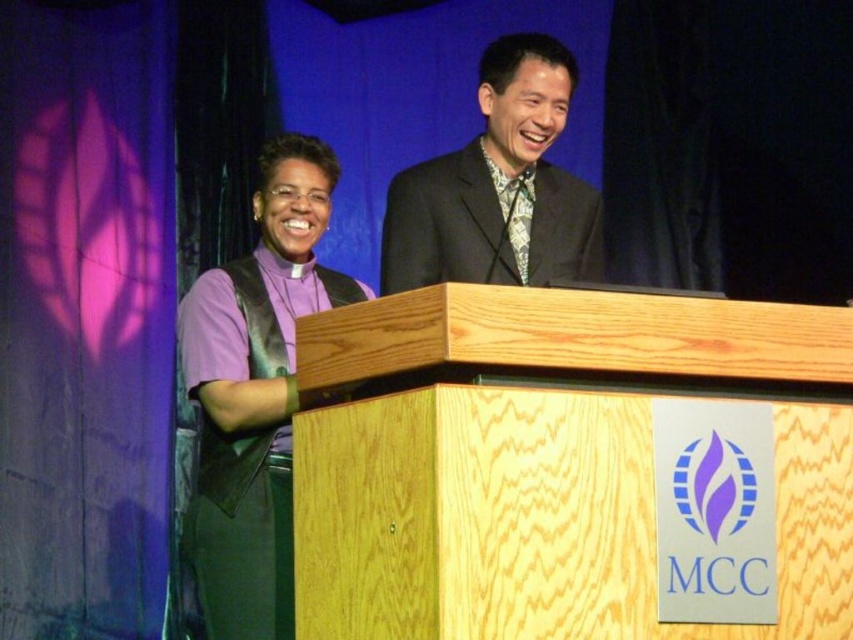
Question: Which of these objects is positioned closest to the dark gray suit at center?

Choices:
 (A) purple matte vest at left
 (B) green patterned tie at center

Answer: (B)

Question: Among these points, which one is nearest to the camera?

Choices:
 (A) (505, 99)
 (B) (300, 301)

Answer: (A)

Question: Can you confirm if light wood podium at center is wider than green patterned tie at center?

Choices:
 (A) yes
 (B) no

Answer: (A)

Question: Can you confirm if light wood podium at center is thinner than dark gray suit at center?

Choices:
 (A) yes
 (B) no

Answer: (B)

Question: Can you confirm if light wood podium at center is smaller than green patterned tie at center?

Choices:
 (A) no
 (B) yes

Answer: (A)

Question: Which of the following is the closest to the observer?

Choices:
 (A) dark gray suit at center
 (B) light wood podium at center

Answer: (B)